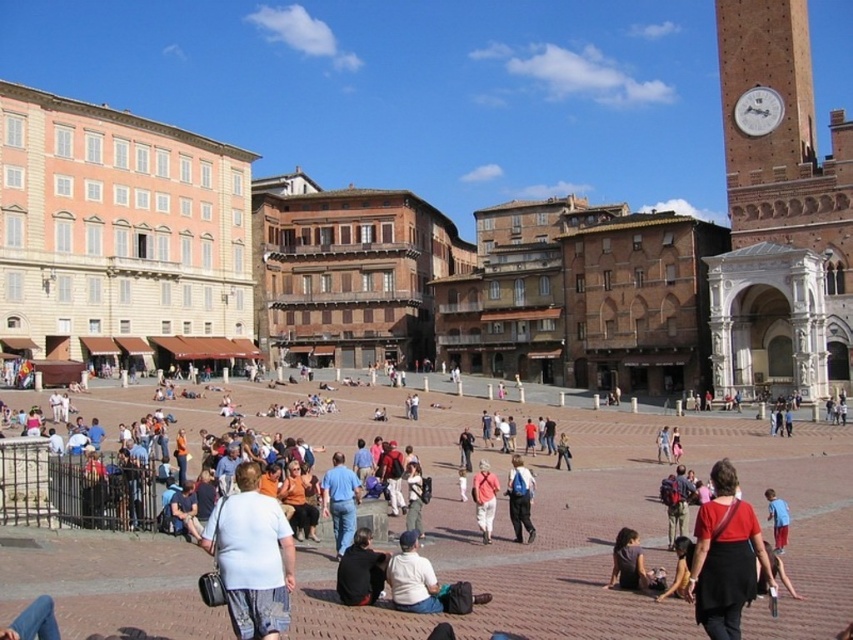
Is light blue cotton shirt at center thinner than blue shirt at center?

In fact, light blue cotton shirt at center might be wider than blue shirt at center.

Does light blue cotton shirt at center have a greater height compared to blue shirt at center?

Correct, light blue cotton shirt at center is much taller as blue shirt at center.

Is point (283, 518) closer to camera compared to point (775, 545)?

Yes, point (283, 518) is closer to viewer.

Where is `light blue cotton shirt at center`? light blue cotton shirt at center is located at coordinates coord(252,556).

Does brown brick clock tower at upper right have a lesser height compared to matte blue backpack at center?

No, brown brick clock tower at upper right is not shorter than matte blue backpack at center.

Between point (807, 252) and point (518, 460), which one is positioned in front?

Point (518, 460)

This screenshot has height=640, width=853. What do you see at coordinates (779, 212) in the screenshot? I see `brown brick clock tower at upper right` at bounding box center [779, 212].

Image resolution: width=853 pixels, height=640 pixels. What are the coordinates of `brown brick clock tower at upper right` in the screenshot? It's located at coord(779,212).

Does light blue cotton shirt at center have a greater height compared to matte blue backpack at center?

Indeed, light blue cotton shirt at center has a greater height compared to matte blue backpack at center.

Does light blue cotton shirt at center appear over matte blue backpack at center?

Indeed, light blue cotton shirt at center is positioned over matte blue backpack at center.

Is point (283, 545) positioned after point (520, 513)?

That is False.

At what (x,y) coordinates should I click in order to perform the action: click on light blue cotton shirt at center. Please return your answer as a coordinate pair (x, y). Looking at the image, I should click on (252, 556).